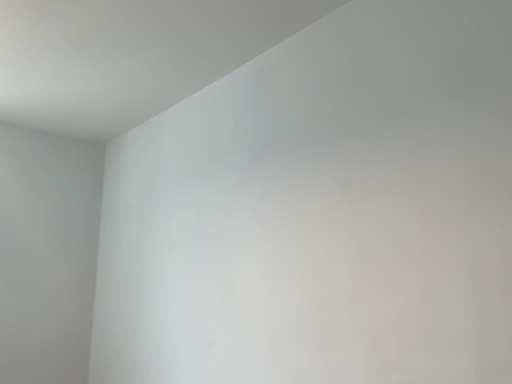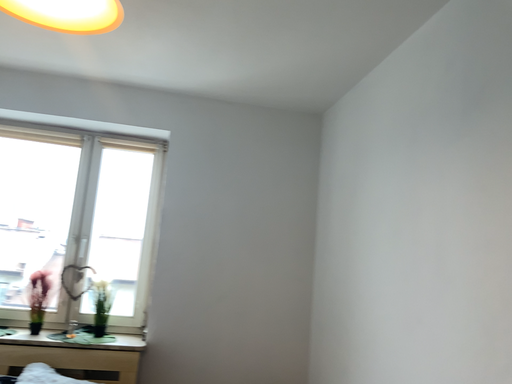
Question: How did the camera likely rotate when shooting the video?

Choices:
 (A) rotated left
 (B) rotated right

Answer: (A)